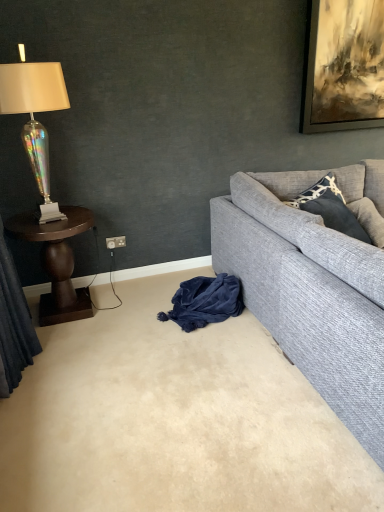
Question: Is dark wood side table at left inside or outside of iridescent fabric curtain at left?

Choices:
 (A) inside
 (B) outside

Answer: (B)

Question: Is dark wood side table at left wider or thinner than iridescent fabric curtain at left?

Choices:
 (A) wide
 (B) thin

Answer: (A)

Question: Which object is the closest to the beige carpet at lower center?

Choices:
 (A) iridescent fabric curtain at left
 (B) velvet blue blanket at lower center
 (C) dark wood side table at left
 (D) dark gray textured pillow at upper right
 (E) gray fabric couch at right

Answer: (B)

Question: Considering the real-world distances, which object is closest to the iridescent fabric curtain at left?

Choices:
 (A) beige carpet at lower center
 (B) dark wood side table at left
 (C) dark gray textured pillow at upper right
 (D) iridescent glass lamp at left
 (E) velvet blue blanket at lower center

Answer: (B)